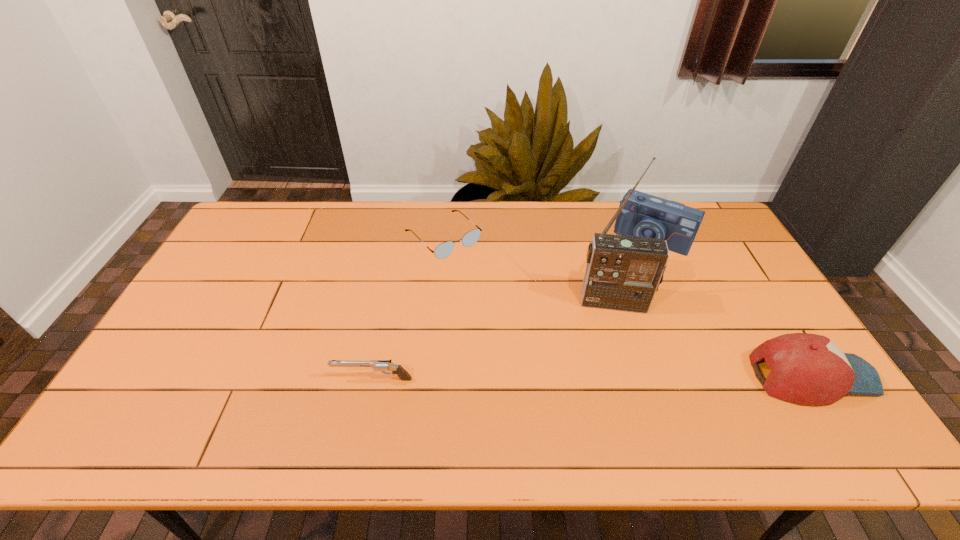
Find the location of a particular element. free space on the desktop that is between the second shortest object and the third shortest object and is positioned on the lenses of the spectacles is located at coordinates (591, 377).

What are the coordinates of `free space on the desktop that is between the fourth tallest object and the baseball cap and is positioned on the display of the radio receiver` in the screenshot? It's located at (621, 377).

At what (x,y) coordinates should I click in order to perform the action: click on vacant space on the desktop that is between the second shortest object and the third tallest object and is positioned on the lens of the camera. Please return your answer as a coordinate pair (x, y). Looking at the image, I should click on (573, 378).